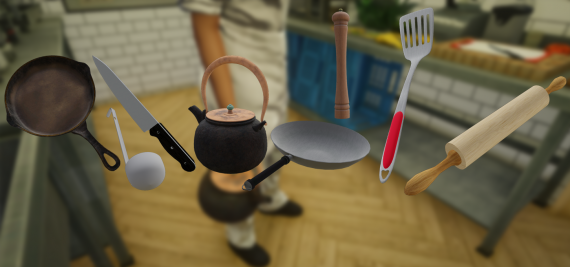
In order to click on pepper grinder in this screenshot , I will do `click(341, 48)`.